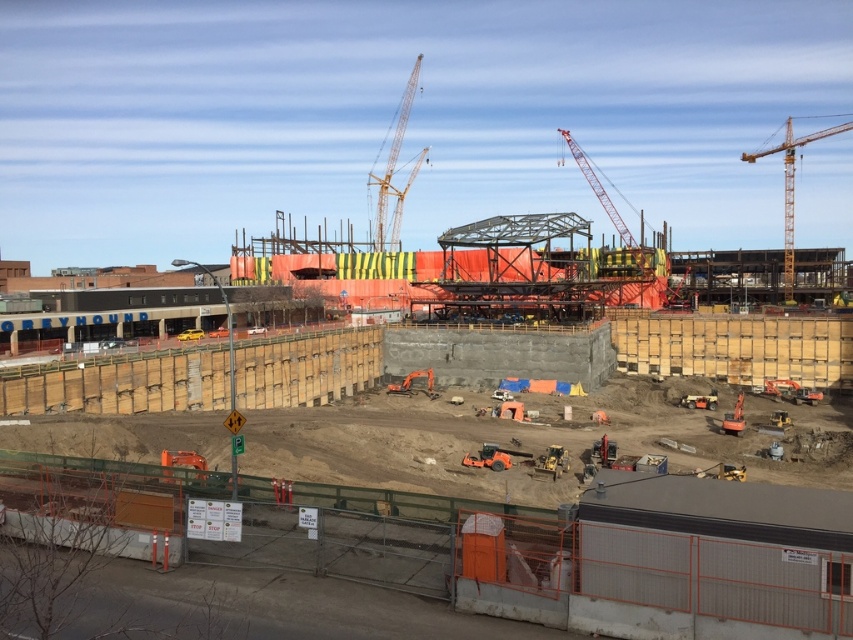
You are a delivery truck driver who needs to enter the construction site through the entrance near the yellow metallic crane at upper right. The concrete wall at center is blocking the path. Can you drive around it?

The concrete wall at center is smaller than the yellow metallic crane at upper right, so you can drive around it by going around the smaller concrete wall at center to access the entrance near the yellow metallic crane at upper right.

You are a surveyor standing at the construction site. You need to determine the order of two points marked on your map. Which point is closer to you when facing the construction site? The points are point (83, 464) and point (386, 164).

Point (83, 464) is in front of point (386, 164), so it is closer to you when facing the construction site.

You are a construction worker who needs to choose a crane to lift a heavy beam. You see two cranes in the image, the yellow metallic crane at upper right and the yellow metallic crane at upper center. Which crane should you choose based on their sizes?

The yellow metallic crane at upper right has a larger size compared to the yellow metallic crane at upper center, so you should choose the yellow metallic crane at upper right to lift the heavy beam since it is bigger and likely more capable.